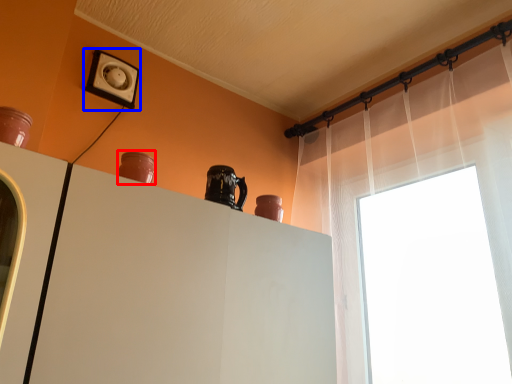
Question: Which point is further to the camera, vase (highlighted by a red box) or electric outlet (highlighted by a blue box)?

Choices:
 (A) vase
 (B) electric outlet

Answer: (B)